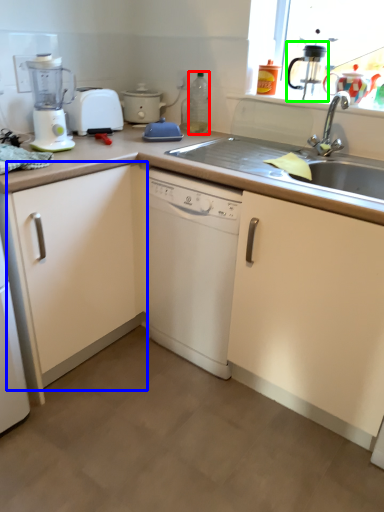
Question: Which is farther away from bottle (highlighted by a red box)? cabinetry (highlighted by a blue box) or coffee machine (highlighted by a green box)?

Choices:
 (A) cabinetry
 (B) coffee machine

Answer: (A)